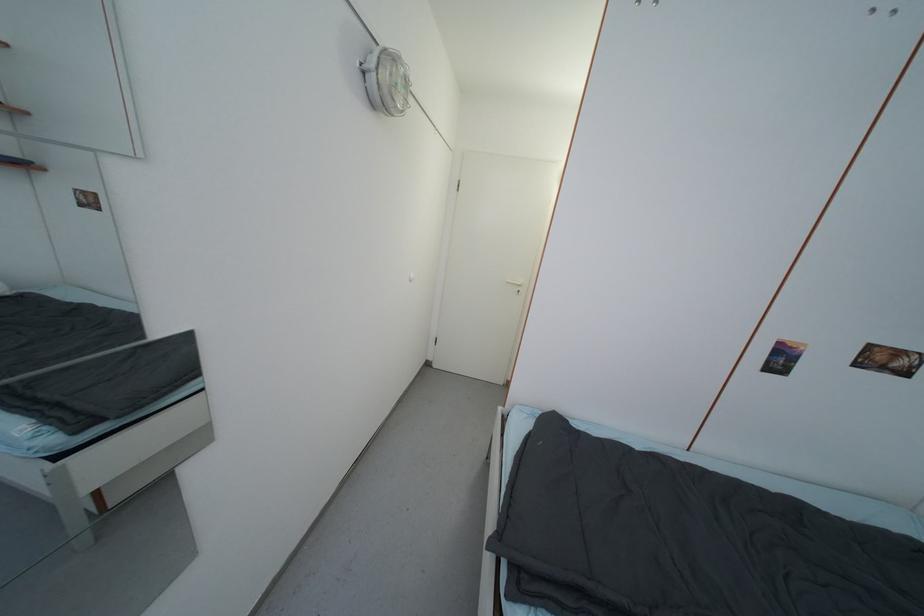
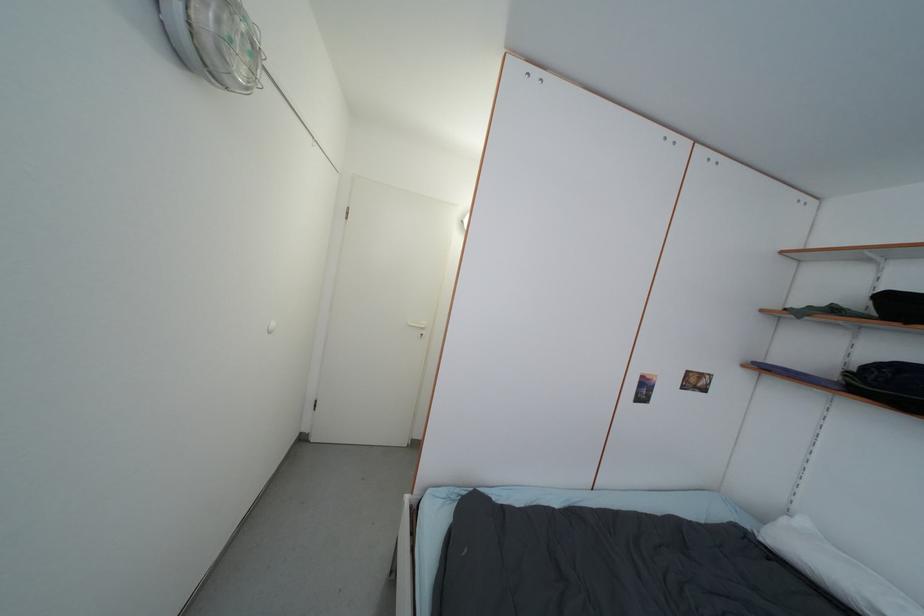
Question: The camera is either moving clockwise (left) or counter-clockwise (right) around the object. The first image is from the beginning of the video and the second image is from the end. Is the camera moving left or right when shooting the video?

Choices:
 (A) Left
 (B) Right

Answer: (A)